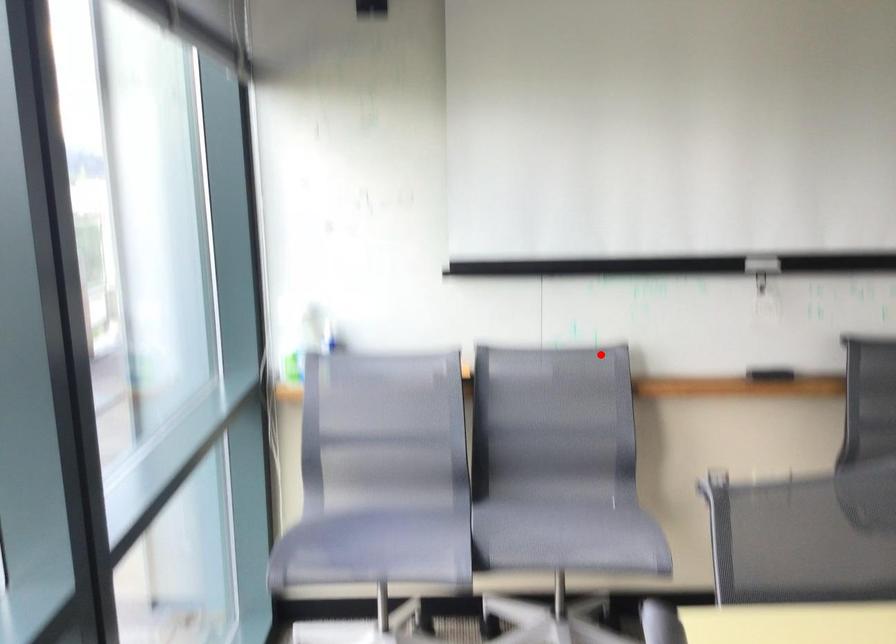
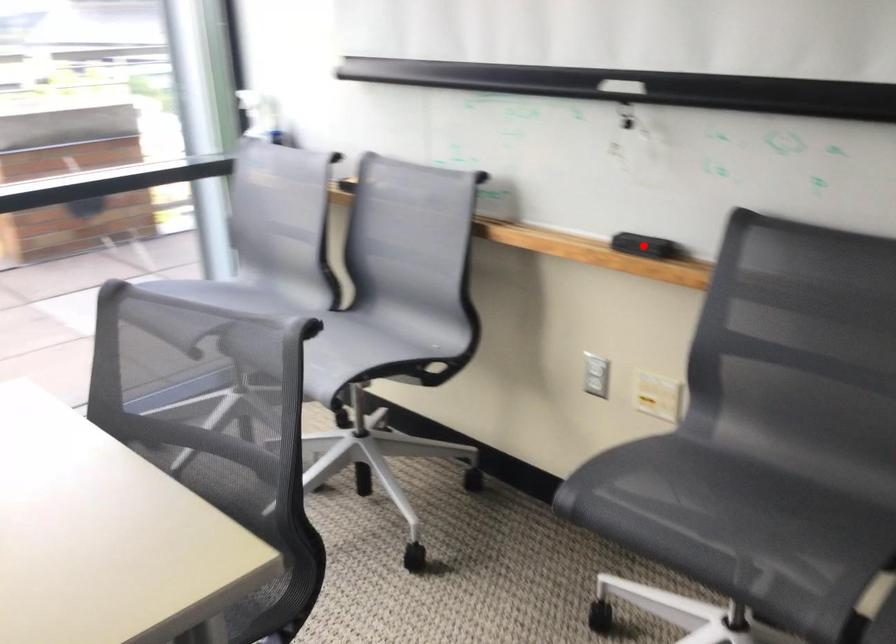
I am providing you with two images of the same scene from different viewpoints. A red point is marked on the first image and another point is marked on the second image. Are the points marked in image1 and image2 representing the same 3D position?

No